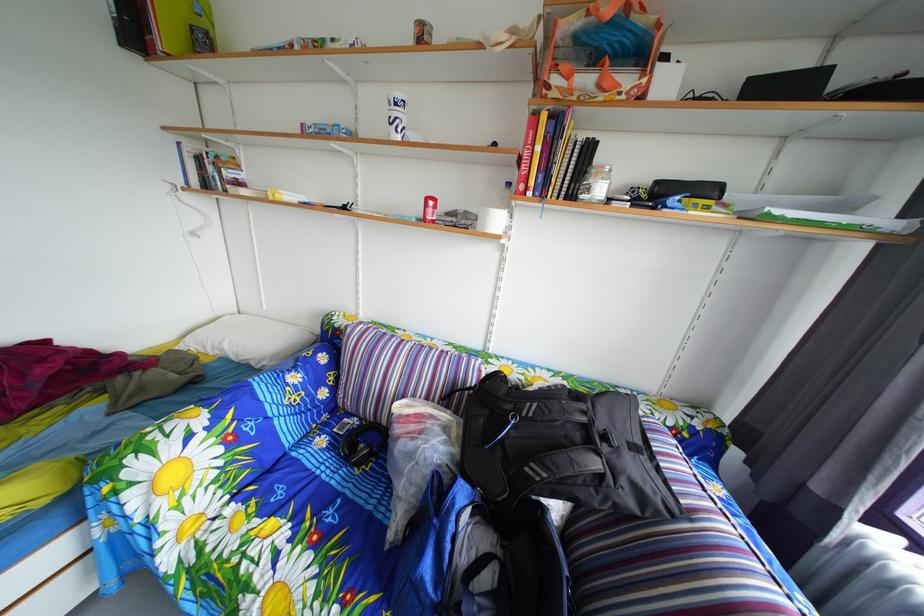
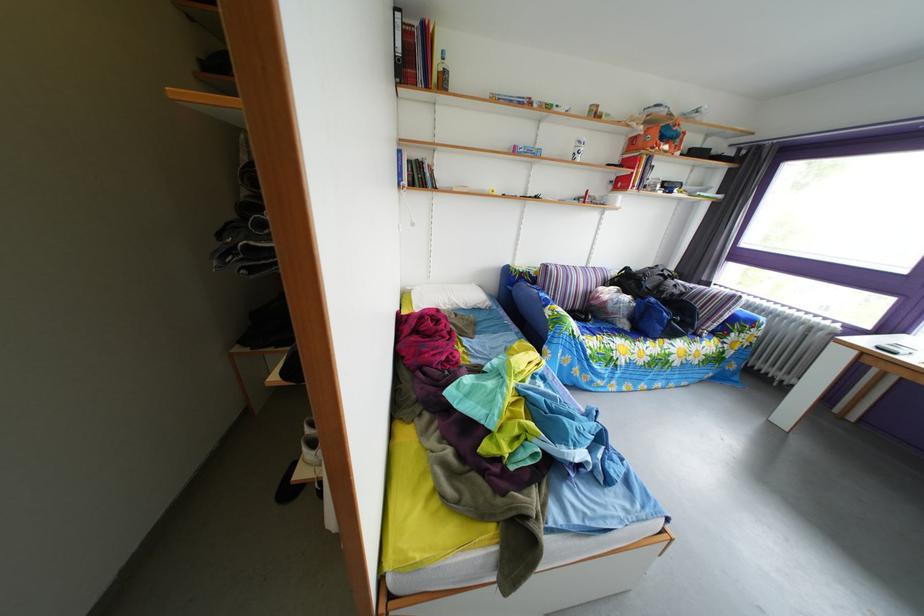
Locate, in the second image, the point that corresponds to [604,70] in the first image.

(673, 147)